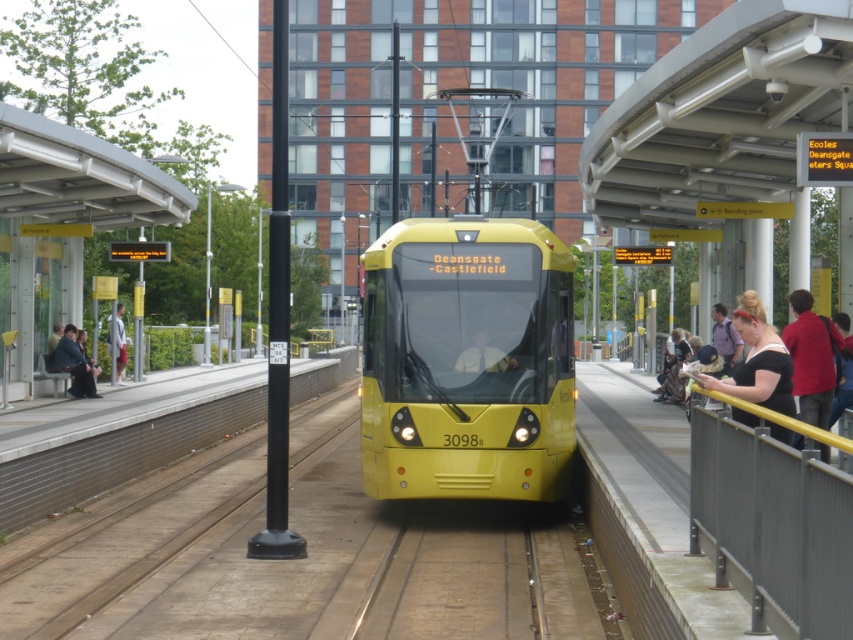
Question: Can you confirm if yellow fabric face at center is positioned to the left of light gray fabric jacket at left?

Choices:
 (A) yes
 (B) no

Answer: (B)

Question: Does dark blue fabric jacket at left have a lesser width compared to yellow fabric face at center?

Choices:
 (A) no
 (B) yes

Answer: (A)

Question: Which of the following is the farthest from the observer?

Choices:
 (A) (802, 340)
 (B) (500, 358)

Answer: (B)

Question: Does yellow matte train at center have a lesser width compared to yellow fabric face at center?

Choices:
 (A) yes
 (B) no

Answer: (B)

Question: Among these points, which one is nearest to the camera?

Choices:
 (A) (795, 444)
 (B) (373, 314)
 (C) (750, 348)
 (D) (502, 561)

Answer: (A)

Question: Which object is farther from the camera taking this photo?

Choices:
 (A) yellow fabric face at center
 (B) metallic gray train track at center

Answer: (A)